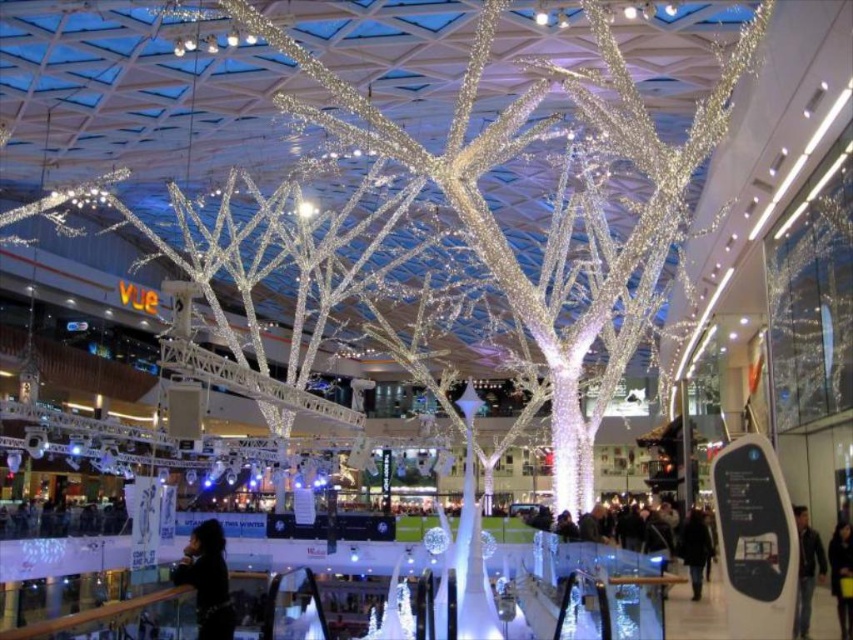
Question: Can you confirm if dark hair at lower left is smaller than dark brown leather jacket at lower right?

Choices:
 (A) no
 (B) yes

Answer: (A)

Question: Among these objects, which one is farthest from the camera?

Choices:
 (A) dark hair at lower left
 (B) dark blue jacket at lower right
 (C) dark brown leather jacket at lower right

Answer: (C)

Question: Which point is farther from the camera taking this photo?

Choices:
 (A) (693, 563)
 (B) (221, 628)
 (C) (840, 604)
 (D) (811, 589)

Answer: (A)

Question: Is dark hair at lower left positioned behind dark blue jacket at lower right?

Choices:
 (A) yes
 (B) no

Answer: (A)

Question: Considering the real-world distances, which object is farthest from the dark blue jacket at lower right?

Choices:
 (A) black fabric at lower right
 (B) dark hair at lower left

Answer: (B)

Question: Where is dark hair at lower left located in relation to black fabric at lower right in the image?

Choices:
 (A) below
 (B) above

Answer: (A)